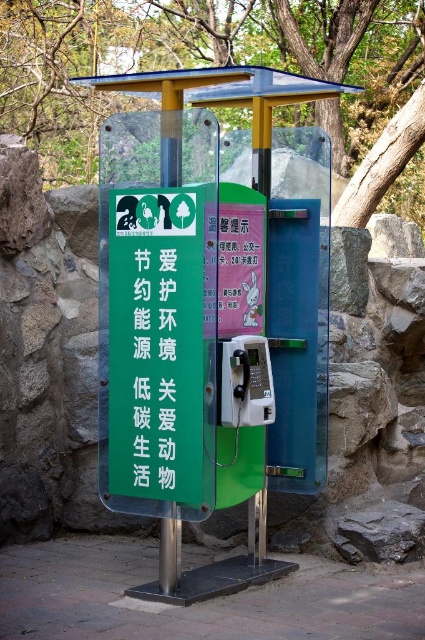
Is green metallic bus stop at center positioned behind green matte sign at center?

No, it is in front of green matte sign at center.

Which is behind, point (158, 272) or point (170, 250)?

The point (158, 272) is more distant.

Identify the location of green metallic bus stop at center. (204, 321).

The image size is (425, 640). In order to click on green metallic bus stop at center in this screenshot , I will do `click(204, 321)`.

Who is taller, green metallic sign at center or green matte sign at center?

Standing taller between the two is green metallic sign at center.

Which is in front, point (141, 445) or point (164, 465)?

Point (164, 465) is more forward.

Which is in front, point (122, 355) or point (133, 360)?

Point (133, 360) is in front.

Find the location of a particular element. green metallic sign at center is located at coordinates (161, 349).

Is point (260, 48) farther from viewer compared to point (175, 360)?

Yes, it is.

Is green plastic tree at upper center thinner than green matte sign at center?

No, green plastic tree at upper center is not thinner than green matte sign at center.

What are the coordinates of `green plastic tree at upper center` in the screenshot? It's located at (201, 61).